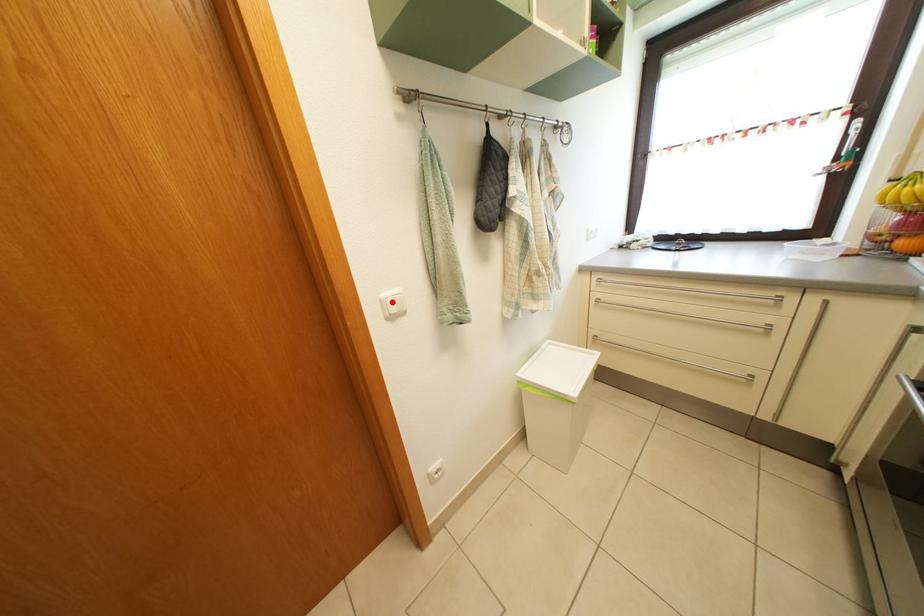
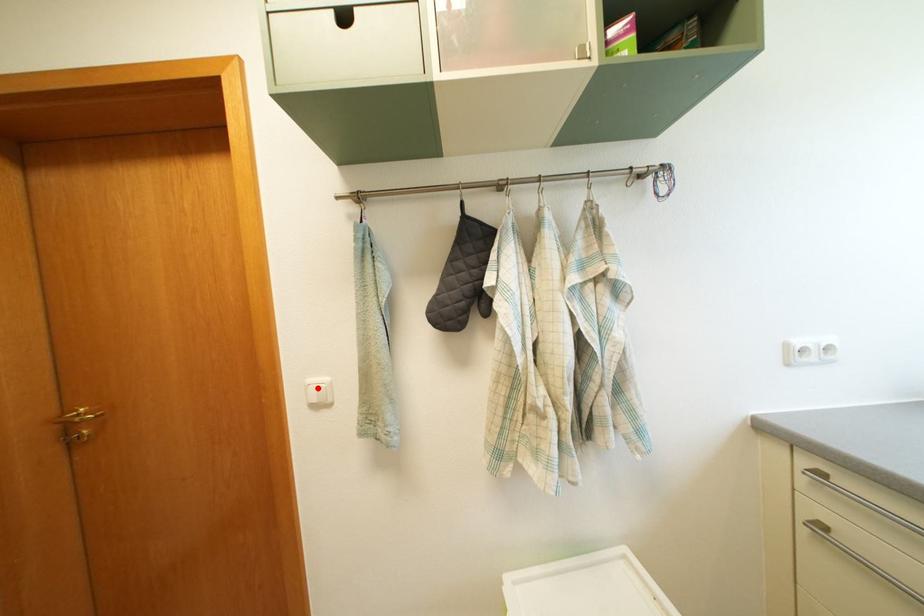
I am providing you with two images of the same scene from different viewpoints. A red point is marked on the first image and another point is marked on the second image. Is the marked point in image1 the same physical position as the marked point in image2?

Yes